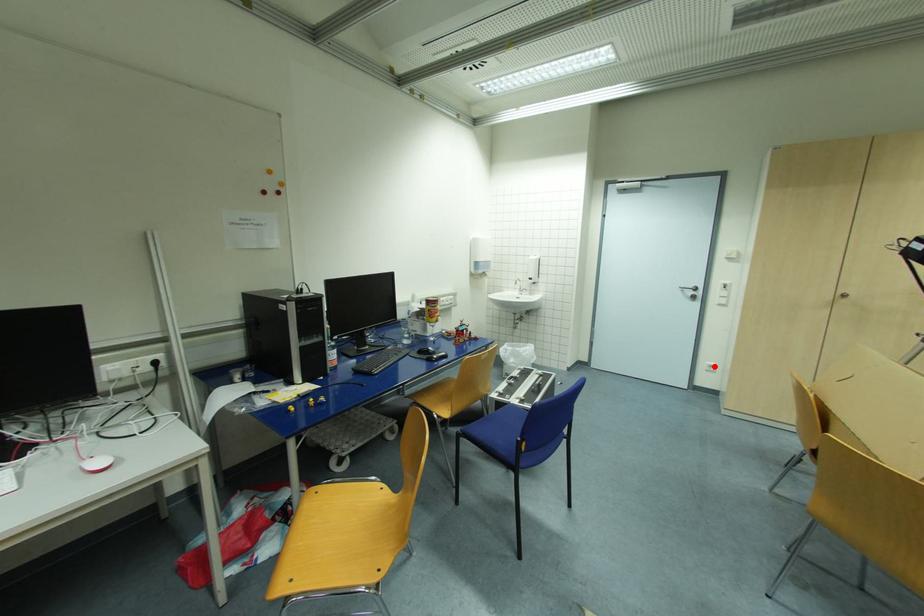
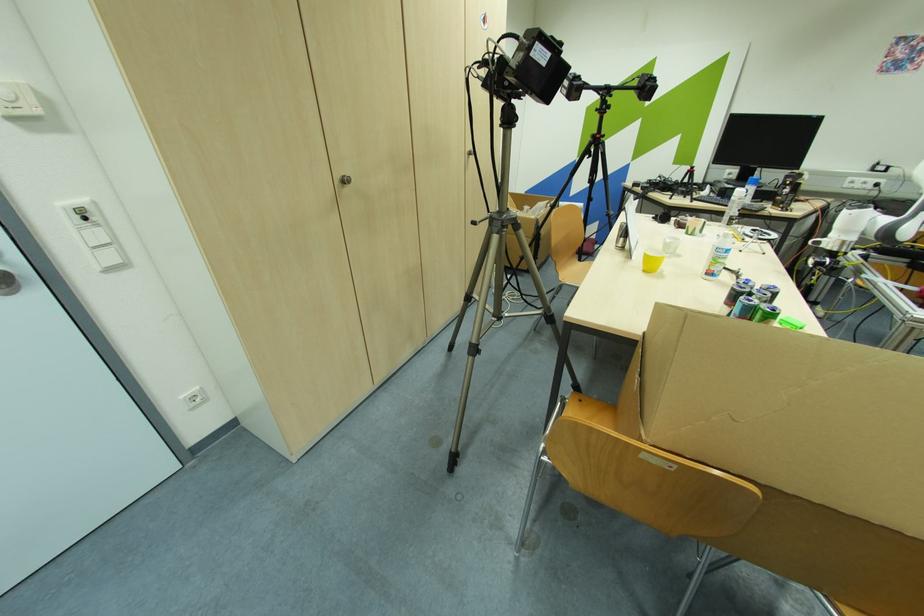
Find the pixel in the second image that matches the highlighted location in the first image.

(198, 399)